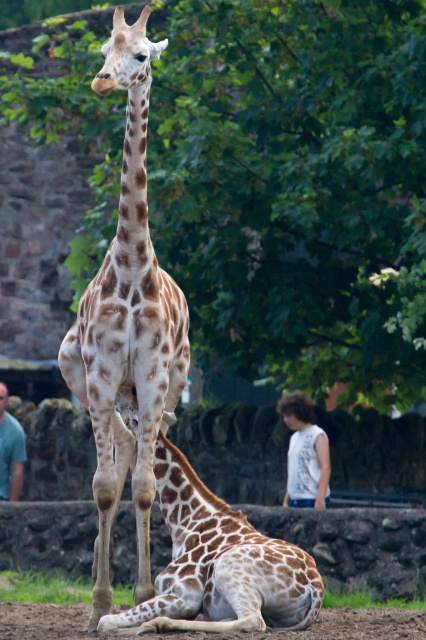
Question: Which of the following is the closest to the observer?

Choices:
 (A) (207, 620)
 (B) (298, 435)
 (C) (13, 444)
 (D) (380, 221)

Answer: (A)

Question: Among these points, which one is farthest from the camera?

Choices:
 (A) (101, 396)
 (B) (310, 464)

Answer: (B)

Question: Can you confirm if brown soil at lower center is positioned to the left of blue shirt at lower left?

Choices:
 (A) no
 (B) yes

Answer: (A)

Question: Does brown soil at lower center have a greater width compared to white sleeveless shirt at lower right?

Choices:
 (A) no
 (B) yes

Answer: (B)

Question: Is spotted fur giraffe at center smaller than white sleeveless shirt at lower right?

Choices:
 (A) no
 (B) yes

Answer: (B)

Question: Based on their relative distances, which object is farther from the blue shirt at lower left?

Choices:
 (A) green leafy tree at upper center
 (B) spotted fur giraffe at lower center
 (C) white sleeveless shirt at lower right
 (D) brown soil at lower center

Answer: (B)